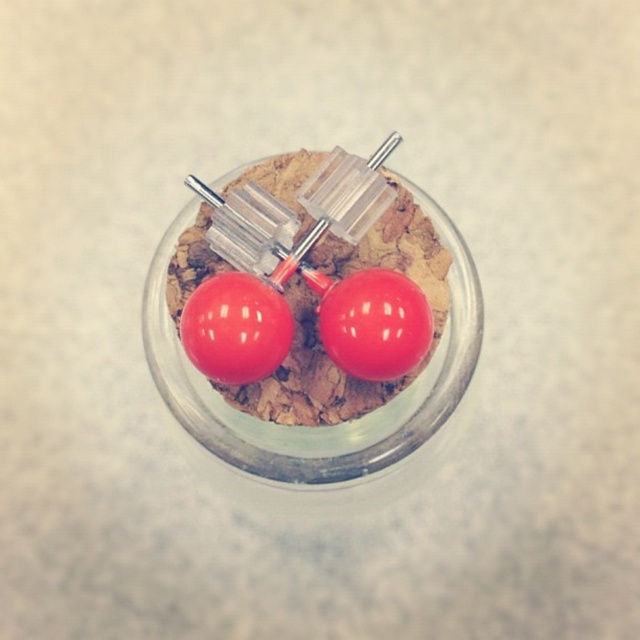
You are a chef preparing a dessert display and need to place a glossy plastic cherry at center on top of a brownie in a jar. The jar is located at point (374, 324). Can you confirm if the current setup allows placing the cherry there?

Yes, the glossy plastic cherry at center can be placed at point (374, 324) because that is exactly where the cherry is located according to the description.

You are designing a display for a jewelry store and want to place the glossy plastic earrings at center and the glossy red cherry at center on a shelf. The shelf has a height limit of 10 cm. If the combined height of both items is 9 cm, will they fit together on the shelf?

The glossy plastic earrings at center has a greater height compared to the glossy red cherry at center. Since their combined height is 9 cm, which is under the 10 cm limit, they will fit together on the shelf.